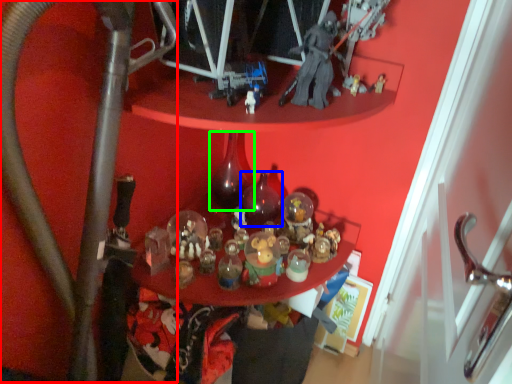
Question: Estimate the real-world distances between objects in this image. Which object is farther from water pipe (highlighted by a red box), bottle (highlighted by a blue box) or bottle (highlighted by a green box)?

Choices:
 (A) bottle
 (B) bottle

Answer: (A)